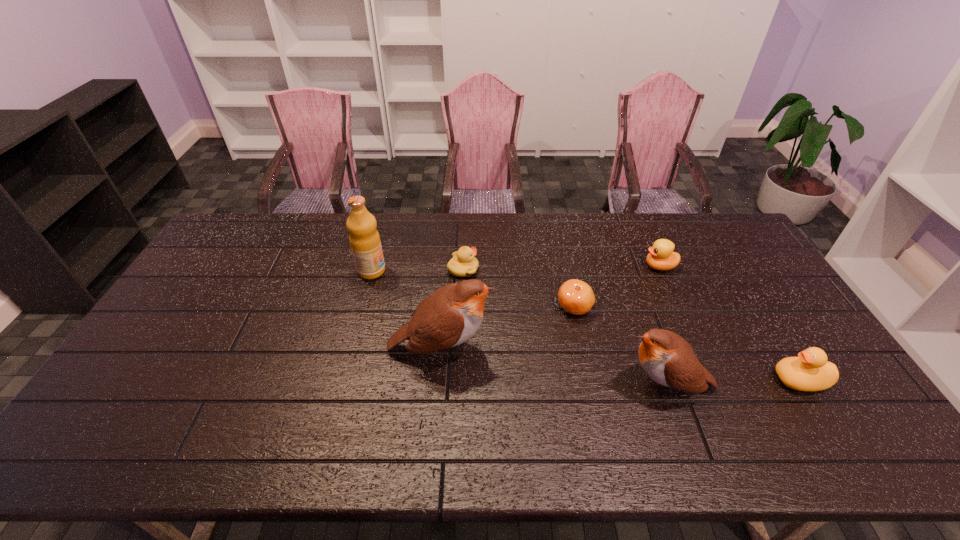
This screenshot has width=960, height=540. I want to click on vacant space located 0.150m on the face of the duck, so click(717, 380).

I want to click on vacant space located 0.320m on the face of the duck, so click(x=653, y=380).

The height and width of the screenshot is (540, 960). Find the location of `bird present at the near edge`. bird present at the near edge is located at coordinates (668, 359).

Where is `duck that is at the near edge`? This screenshot has height=540, width=960. duck that is at the near edge is located at coordinates (810, 371).

What are the coordinates of `object located at the right edge` in the screenshot? It's located at (x=810, y=371).

Locate an element on the screen. object that is positioned at the near right corner is located at coordinates (810, 371).

At what (x,y) coordinates should I click in order to perform the action: click on vacant space at the far edge of the desktop. Please return your answer as a coordinate pair (x, y). The height and width of the screenshot is (540, 960). Looking at the image, I should click on (656, 223).

This screenshot has height=540, width=960. Identify the location of vacant space at the near edge of the desktop. (253, 397).

You are a GUI agent. You are given a task and a screenshot of the screen. Output one action in this format:
    pyautogui.click(x=<x>, y=<y>)
    Task: Click on the free space at the left edge of the desktop
    The image size is (960, 540).
    Given the screenshot: What is the action you would take?
    pyautogui.click(x=159, y=363)

You are a GUI agent. You are given a task and a screenshot of the screen. Output one action in this format:
    pyautogui.click(x=<x>, y=<y>)
    Task: Click on the vacant space at the right edge of the desktop
    
    Given the screenshot: What is the action you would take?
    pyautogui.click(x=801, y=348)